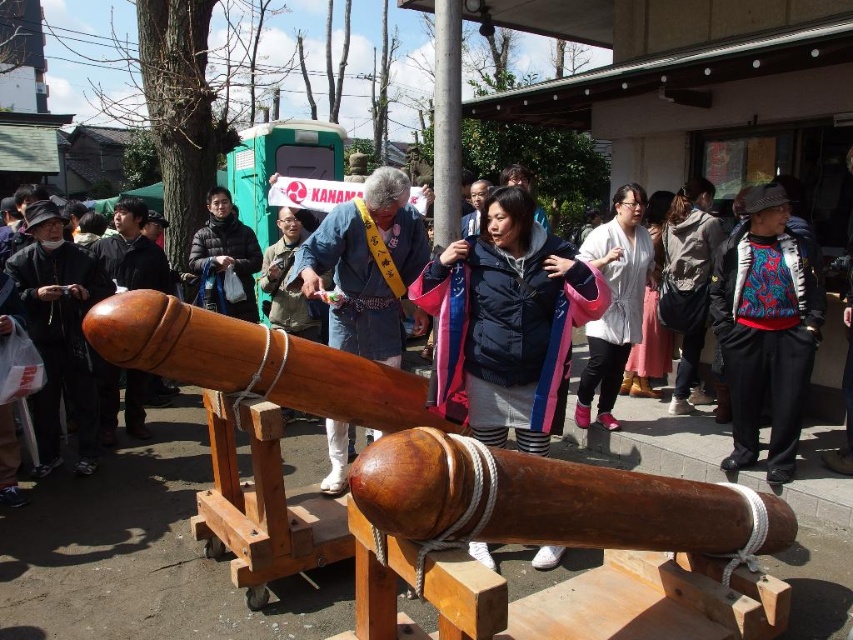
Question: Which point is closer to the camera?

Choices:
 (A) matte black jacket at left
 (B) white silk kimono at center
 (C) shiny brown wood cannon at center

Answer: (C)

Question: Can you confirm if matte black jacket at left is bigger than matte black jacket at center?

Choices:
 (A) yes
 (B) no

Answer: (A)

Question: Does white silk kimono at center appear under matte black jacket at center?

Choices:
 (A) no
 (B) yes

Answer: (B)

Question: Which point is farther from the camera taking this photo?

Choices:
 (A) (548, 291)
 (B) (688, 257)
 (C) (634, 339)
 (D) (32, 324)

Answer: (B)

Question: Does dark gray fabric jacket at center appear over matte black jacket at center?

Choices:
 (A) no
 (B) yes

Answer: (A)

Question: Estimate the real-world distances between objects in this image. Which object is closer to the matte black jacket at left?

Choices:
 (A) shiny brown wood cannon at center
 (B) dark gray fabric jacket at center
 (C) white silk kimono at center
 (D) blue and red patterned sweater at center

Answer: (A)